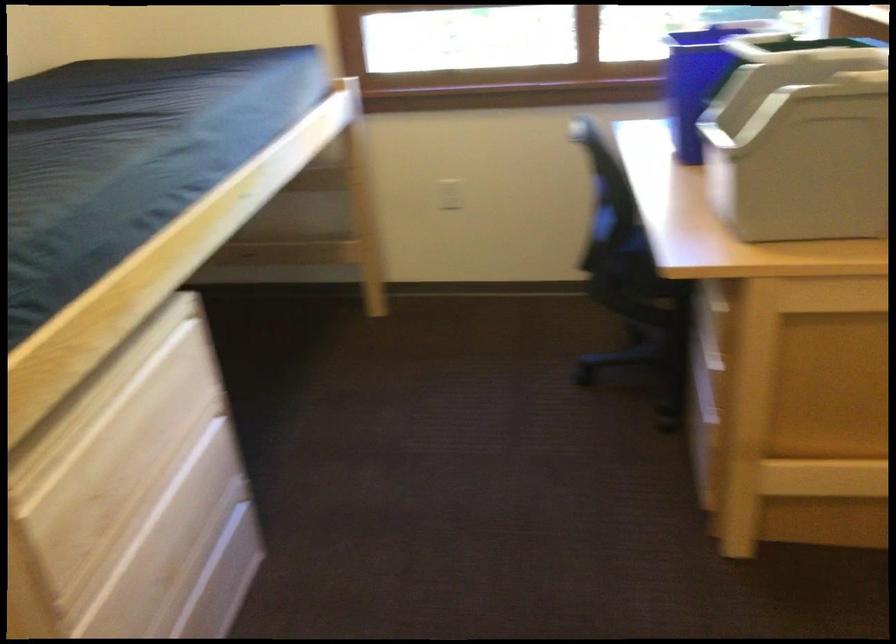
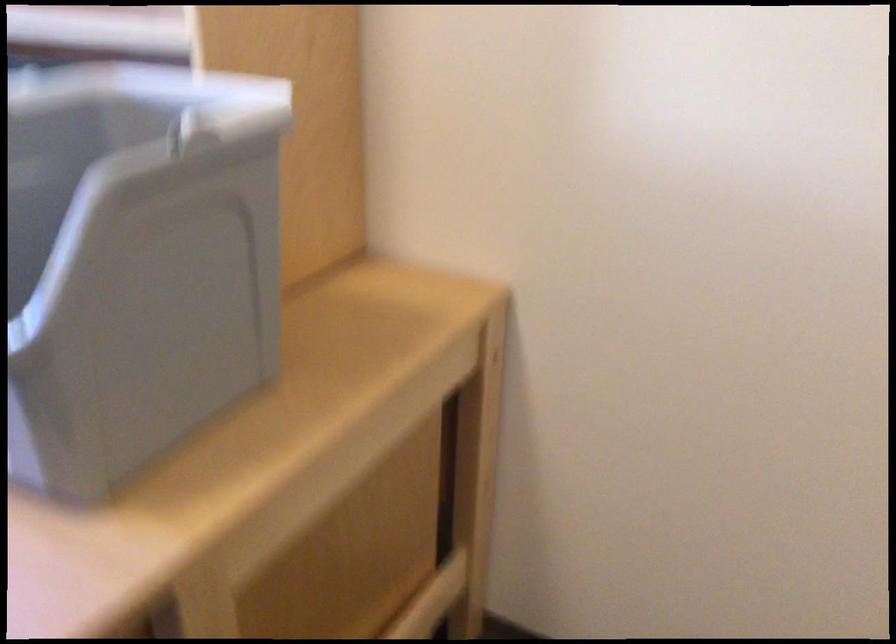
Where in the second image is the point corresponding to the point at 810,134 from the first image?

(135, 263)